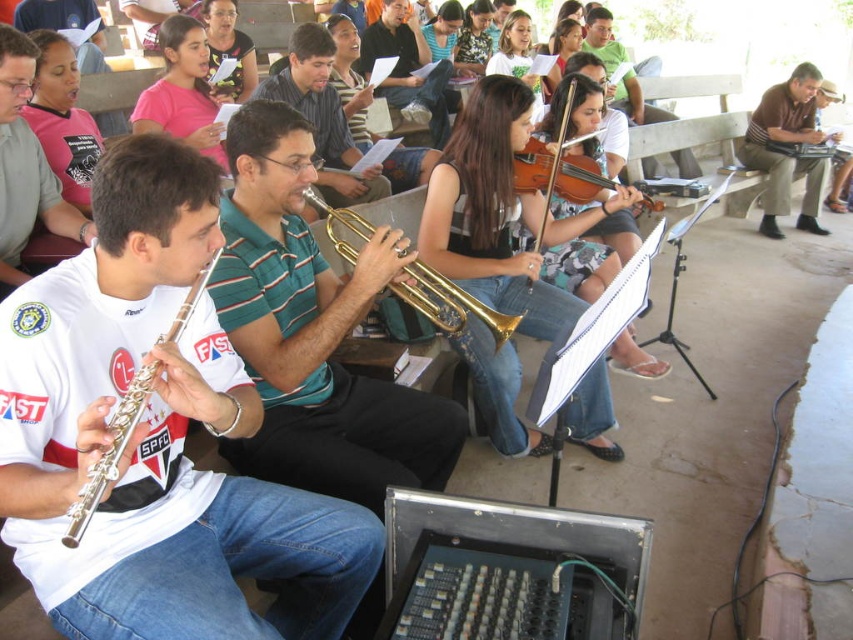
You are a photographer standing in front of the gold shiny trumpet at center and the wooden violin at center. You want to take a photo that captures both instruments clearly. Which instrument should you adjust your focus on to ensure both are in sharp focus?

Since the gold shiny trumpet at center is closer to the viewer than the wooden violin at center, you should focus on the trumpet to ensure both are in sharp focus as the depth of field will naturally include the violin in the background.

You are standing at the front of the pavilion where the musical performance is happening. You notice two points marked in the scene. The first point is at coordinates point (36, 397) and the second is at point (601, 186). If you were to walk towards the first point, would you be moving towards the musicians playing the flute and trumpet or away from them?

Since point (36, 397) is in front of point (601, 186), and the musicians are in the foreground, walking towards the first point would mean moving towards the flute and trumpet players.